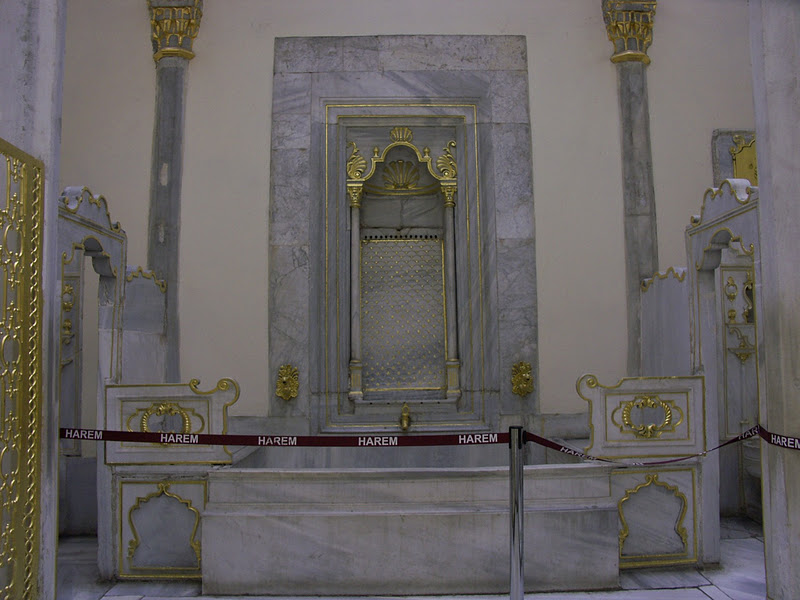
The height and width of the screenshot is (600, 800). In order to click on metal support pole in this screenshot , I will do `click(518, 506)`.